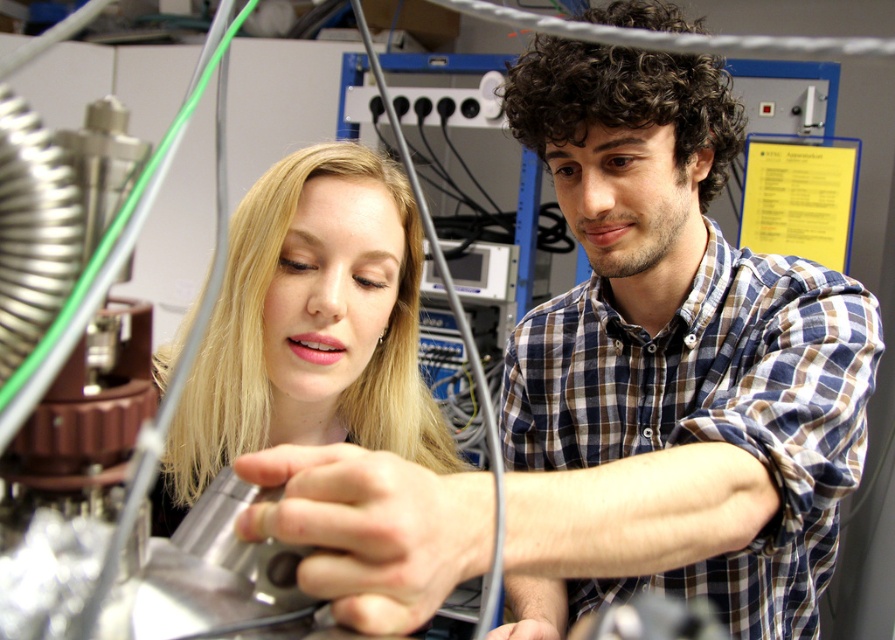
Measure the distance between point (680, 371) and camera.

Point (680, 371) and camera are 37.82 inches apart from each other.

Measure the distance between blue checkered shirt at center and blonde hair at center.

A distance of 26.96 centimeters exists between blue checkered shirt at center and blonde hair at center.

Locate an element on the screen. blue checkered shirt at center is located at coordinates (680, 337).

Where is `blue checkered shirt at center`? The width and height of the screenshot is (895, 640). blue checkered shirt at center is located at coordinates (680, 337).